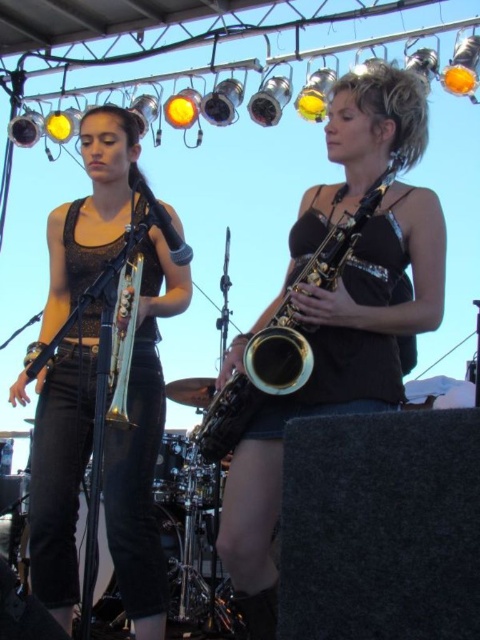
Question: Which object is positioned farthest from the matte black trombone at left?

Choices:
 (A) gold lacquered saxophone at center
 (B) shiny gold saxophone at center

Answer: (B)

Question: Can you confirm if matte black trombone at left is thinner than gold lacquered saxophone at center?

Choices:
 (A) yes
 (B) no

Answer: (B)

Question: Does shiny gold saxophone at center have a lesser width compared to matte black trombone at left?

Choices:
 (A) no
 (B) yes

Answer: (A)

Question: Considering the real-world distances, which object is closest to the shiny gold saxophone at center?

Choices:
 (A) matte black trombone at left
 (B) gold lacquered saxophone at center

Answer: (B)

Question: Is matte black trombone at left to the left of gold lacquered saxophone at center from the viewer's perspective?

Choices:
 (A) no
 (B) yes

Answer: (B)

Question: Which point is farther from the camera taking this photo?

Choices:
 (A) (385, 205)
 (B) (220, 445)
 (C) (156, 401)

Answer: (C)